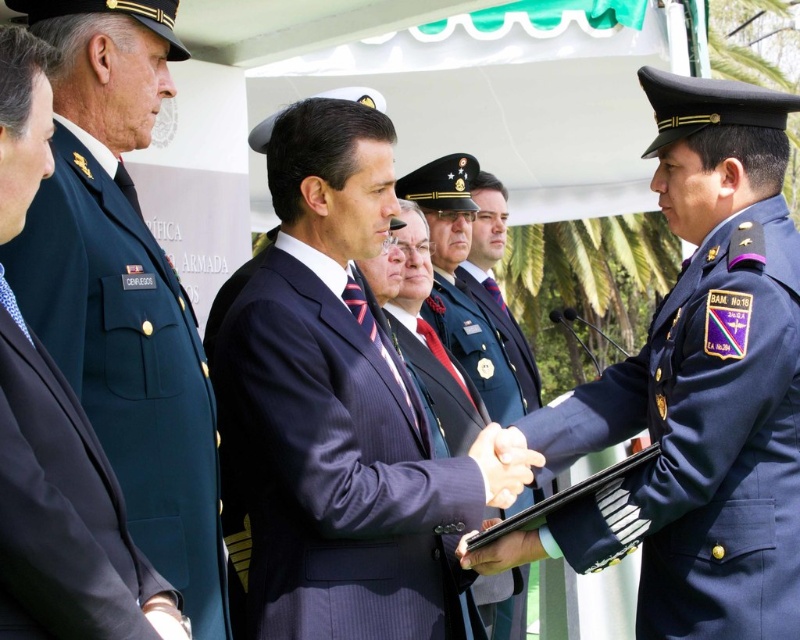
Is navy blue fabric uniform at right smaller than shiny blue uniform at center?

Actually, navy blue fabric uniform at right might be larger than shiny blue uniform at center.

Locate an element on the screen. Image resolution: width=800 pixels, height=640 pixels. navy blue fabric uniform at right is located at coordinates (700, 444).

Locate an element on the screen. This screenshot has height=640, width=800. navy blue fabric uniform at right is located at coordinates (700, 444).

Describe the element at coordinates (700, 444) in the screenshot. I see `navy blue fabric uniform at right` at that location.

Can you confirm if navy blue fabric uniform at right is positioned to the right of green fabric uniform at left?

Indeed, navy blue fabric uniform at right is positioned on the right side of green fabric uniform at left.

Does point (630, 524) come behind point (102, 225)?

Yes, point (630, 524) is behind point (102, 225).

The width and height of the screenshot is (800, 640). I want to click on navy blue fabric uniform at right, so click(x=700, y=444).

Who is more distant from viewer, (500, 476) or (505, 552)?

Point (505, 552)

Is point (512, 461) closer to viewer compared to point (502, 554)?

Yes, point (512, 461) is closer to viewer.

The image size is (800, 640). In order to click on smooth skin handshake at center in this screenshot , I will do `click(504, 464)`.

This screenshot has width=800, height=640. Find the location of `smooth skin handshake at center`. smooth skin handshake at center is located at coordinates (504, 464).